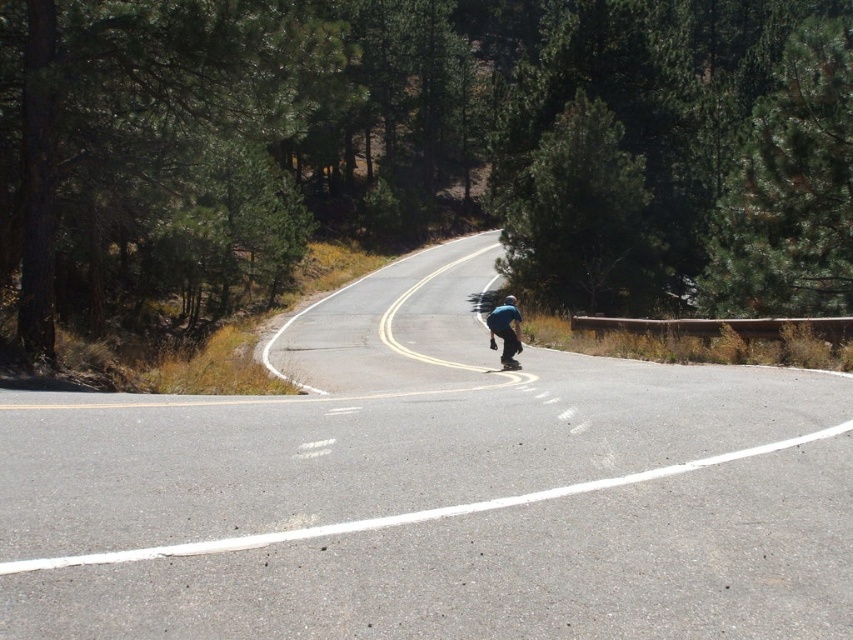
Question: Is green textured tree at upper center to the left of black smooth skateboard at center from the viewer's perspective?

Choices:
 (A) no
 (B) yes

Answer: (A)

Question: Based on their relative distances, which object is farther from the green textured tree at upper center?

Choices:
 (A) green leafy tree at upper center
 (B) blue matte skateboard at center

Answer: (B)

Question: Is asphalt road at center above green leafy tree at upper center?

Choices:
 (A) no
 (B) yes

Answer: (A)

Question: Which point appears farthest from the camera in this image?

Choices:
 (A) (799, 289)
 (B) (811, 124)

Answer: (A)

Question: Which object is closer to the camera taking this photo?

Choices:
 (A) black smooth skateboard at center
 (B) green leafy tree at left
 (C) green textured tree at upper center

Answer: (B)

Question: Can you confirm if green textured tree at upper center is positioned to the right of green textured pine tree at upper right?

Choices:
 (A) yes
 (B) no

Answer: (B)